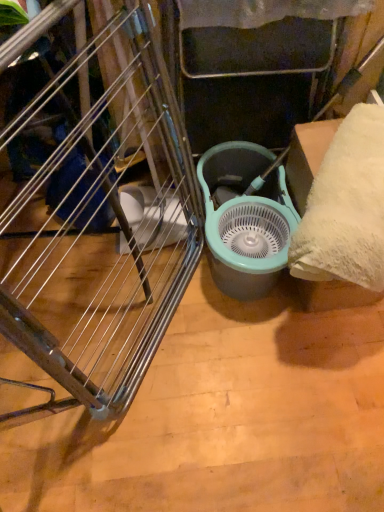
Question: In terms of width, does teal plastic mechanical fan at center look wider or thinner when compared to brushed metal drying rack at left?

Choices:
 (A) wide
 (B) thin

Answer: (A)

Question: Based on their sizes in the image, would you say teal plastic mechanical fan at center is bigger or smaller than brushed metal drying rack at left?

Choices:
 (A) small
 (B) big

Answer: (A)

Question: From a real-world perspective, is teal plastic mechanical fan at center physically located above or below brushed metal drying rack at left?

Choices:
 (A) above
 (B) below

Answer: (B)

Question: From the image's perspective, is brushed metal drying rack at left above or below teal plastic mechanical fan at center?

Choices:
 (A) below
 (B) above

Answer: (A)

Question: In the image, is brushed metal drying rack at left positioned in front of or behind teal plastic mechanical fan at center?

Choices:
 (A) front
 (B) behind

Answer: (A)

Question: From a real-world perspective, is brushed metal drying rack at left positioned above or below teal plastic mechanical fan at center?

Choices:
 (A) below
 (B) above

Answer: (B)

Question: In terms of size, does brushed metal drying rack at left appear bigger or smaller than teal plastic mechanical fan at center?

Choices:
 (A) small
 (B) big

Answer: (B)